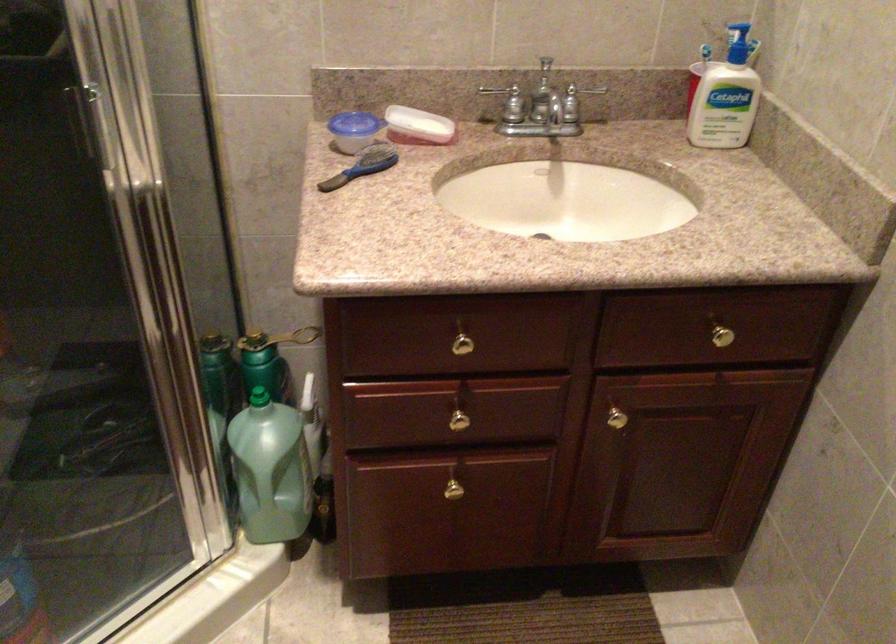
Locate an element on the screen. The image size is (896, 644). gold bottle handle is located at coordinates (721, 336).